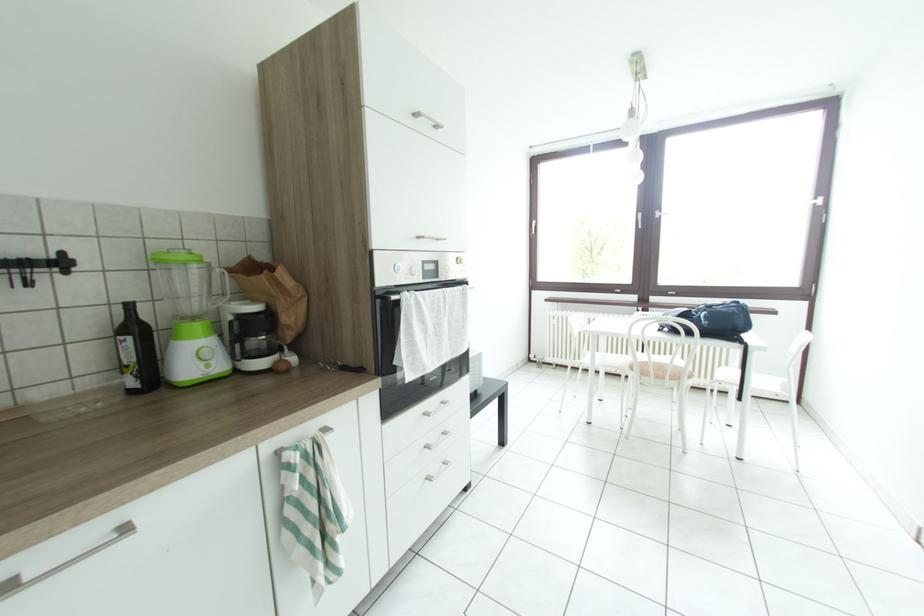
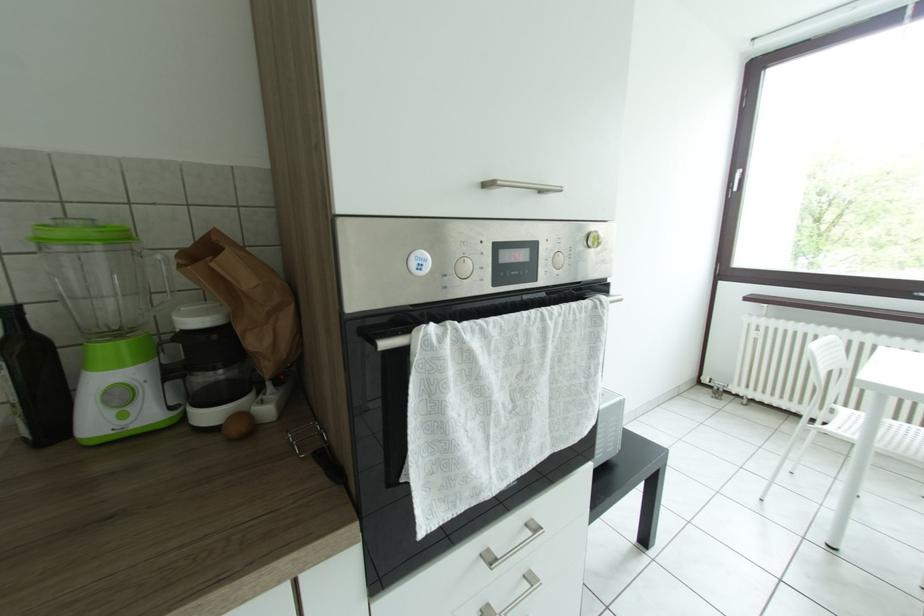
Question: Which direction would the cameraman need to move to produce the second image? Reply with the corresponding letter.

Choices:
 (A) Left
 (B) Right
 (C) Forward
 (D) Backward

Answer: (C)